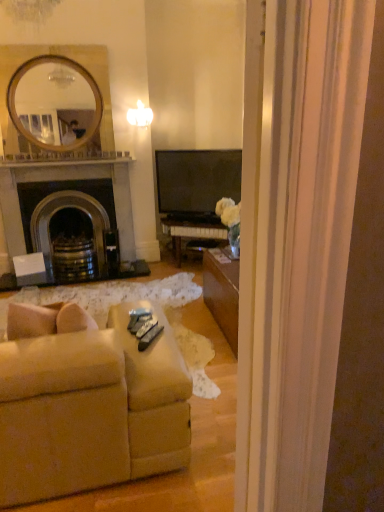
Locate an element on the screen. The height and width of the screenshot is (512, 384). beige fabric couch at lower left is located at coordinates (90, 411).

Measure the distance between beige fabric couch at lower left and camera.

beige fabric couch at lower left is 5.34 feet from camera.

This screenshot has height=512, width=384. What do you see at coordinates (90, 411) in the screenshot? I see `beige fabric couch at lower left` at bounding box center [90, 411].

In order to face dark gray stone fireplace at left, should I rotate leftwards or rightwards?

You should rotate left by 15.931 degrees.

Image resolution: width=384 pixels, height=512 pixels. Identify the location of dark gray stone fireplace at left. (66, 203).

What do you see at coordinates (66, 203) in the screenshot? The height and width of the screenshot is (512, 384). I see `dark gray stone fireplace at left` at bounding box center [66, 203].

What are the coordinates of `beige fabric couch at lower left` in the screenshot? It's located at (90, 411).

Which is more to the right, dark gray stone fireplace at left or beige fabric couch at lower left?

beige fabric couch at lower left.

Consider the image. Which object is closer to the camera taking this photo, dark gray stone fireplace at left or beige fabric couch at lower left?

beige fabric couch at lower left is in front.

Does point (124, 206) come closer to viewer compared to point (53, 394)?

That is False.

From the image's perspective, is dark gray stone fireplace at left above or below beige fabric couch at lower left?

Based on their image positions, dark gray stone fireplace at left is located above beige fabric couch at lower left.

From the picture: From a real-world perspective, is dark gray stone fireplace at left over beige fabric couch at lower left?

Yes, from a real-world perspective, dark gray stone fireplace at left is above beige fabric couch at lower left.

Does dark gray stone fireplace at left have a lesser width compared to beige fabric couch at lower left?

Yes.

Who is shorter, dark gray stone fireplace at left or beige fabric couch at lower left?

Standing shorter between the two is beige fabric couch at lower left.

In the scene shown: Considering the relative sizes of dark gray stone fireplace at left and beige fabric couch at lower left in the image provided, is dark gray stone fireplace at left bigger than beige fabric couch at lower left?

No.

Is dark gray stone fireplace at left not inside beige fabric couch at lower left?

That's correct, dark gray stone fireplace at left is outside of beige fabric couch at lower left.

Looking at this image, would you consider dark gray stone fireplace at left to be distant from beige fabric couch at lower left?

That's right, there is a large distance between dark gray stone fireplace at left and beige fabric couch at lower left.

Could you tell me if dark gray stone fireplace at left is turned towards beige fabric couch at lower left?

Yes, dark gray stone fireplace at left is facing beige fabric couch at lower left.

Locate an element on the screen. The width and height of the screenshot is (384, 512). studio couch below the dark gray stone fireplace at left (from the image's perspective) is located at coordinates (90, 411).

Is beige fabric couch at lower left at the left side of dark gray stone fireplace at left?

In fact, beige fabric couch at lower left is to the right of dark gray stone fireplace at left.

Which is in front, beige fabric couch at lower left or dark gray stone fireplace at left?

beige fabric couch at lower left is closer to the camera.

Which is nearer, (41, 383) or (25, 197)?

Point (41, 383).

From the image's perspective, is beige fabric couch at lower left on top of dark gray stone fireplace at left?

No, from the image's perspective, beige fabric couch at lower left is not above dark gray stone fireplace at left.

From a real-world perspective, is beige fabric couch at lower left under dark gray stone fireplace at left?

Correct, in the physical world, beige fabric couch at lower left is lower than dark gray stone fireplace at left.

In terms of width, does beige fabric couch at lower left look wider or thinner when compared to dark gray stone fireplace at left?

Clearly, beige fabric couch at lower left has more width compared to dark gray stone fireplace at left.

Considering the sizes of objects beige fabric couch at lower left and dark gray stone fireplace at left in the image provided, who is shorter, beige fabric couch at lower left or dark gray stone fireplace at left?

With less height is beige fabric couch at lower left.

Is beige fabric couch at lower left smaller than dark gray stone fireplace at left?

No.

Can we say beige fabric couch at lower left lies outside dark gray stone fireplace at left?

Absolutely, beige fabric couch at lower left is external to dark gray stone fireplace at left.

Is beige fabric couch at lower left far from dark gray stone fireplace at left?

beige fabric couch at lower left is positioned a significant distance from dark gray stone fireplace at left.

Does beige fabric couch at lower left turn towards dark gray stone fireplace at left?

Yes.

How many degrees apart are the facing directions of beige fabric couch at lower left and dark gray stone fireplace at left?

179 degrees.

This screenshot has width=384, height=512. In order to click on studio couch below the dark gray stone fireplace at left (from the image's perspective) in this screenshot , I will do `click(90, 411)`.

This screenshot has height=512, width=384. Identify the location of fireplace lying behind the beige fabric couch at lower left. (66, 203).

The image size is (384, 512). In the image, there is a beige fabric couch at lower left. What are the coordinates of `fireplace above it (from the image's perspective)` in the screenshot? It's located at (66, 203).